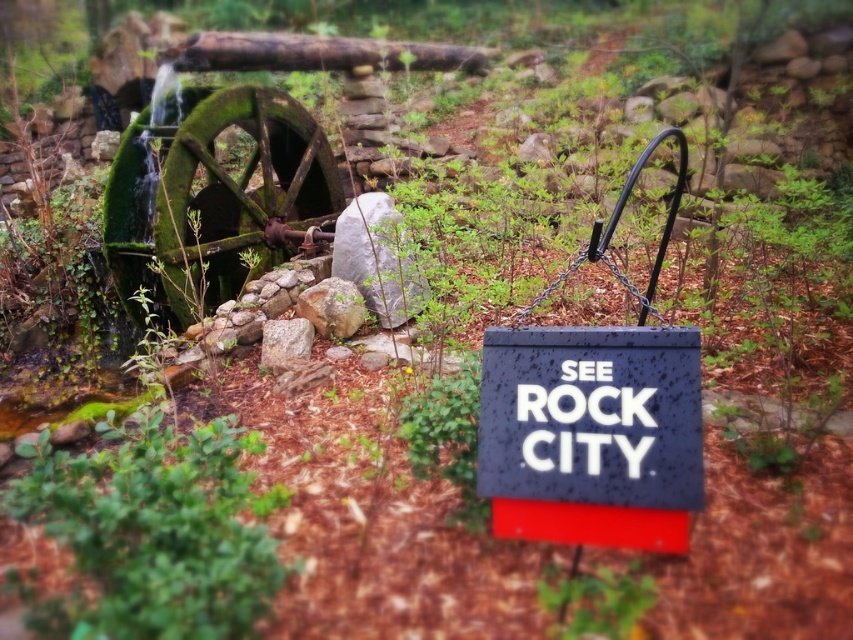
Looking at this image, what are the coordinates of the black textured sign at center?

The coordinates of the black textured sign at center are point (590, 435).

You are planning to hang a new sign that is the same size as the black textured sign at center on a wall. The wall has a space that can accommodate an object as wide as the smooth brown log at upper center. Will the new sign fit in that space?

The black textured sign at center has a width less than the smooth brown log at upper center, so the new sign will fit in the space since it is narrower than the available space.